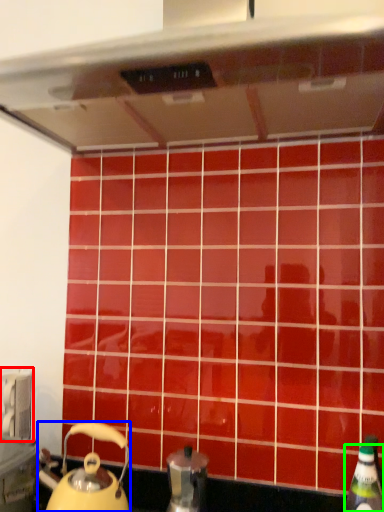
Question: Based on their relative distances, which object is nearer to appliance (highlighted by a red box)? Choose from kettle (highlighted by a blue box) and bottle (highlighted by a green box).

Choices:
 (A) kettle
 (B) bottle

Answer: (A)